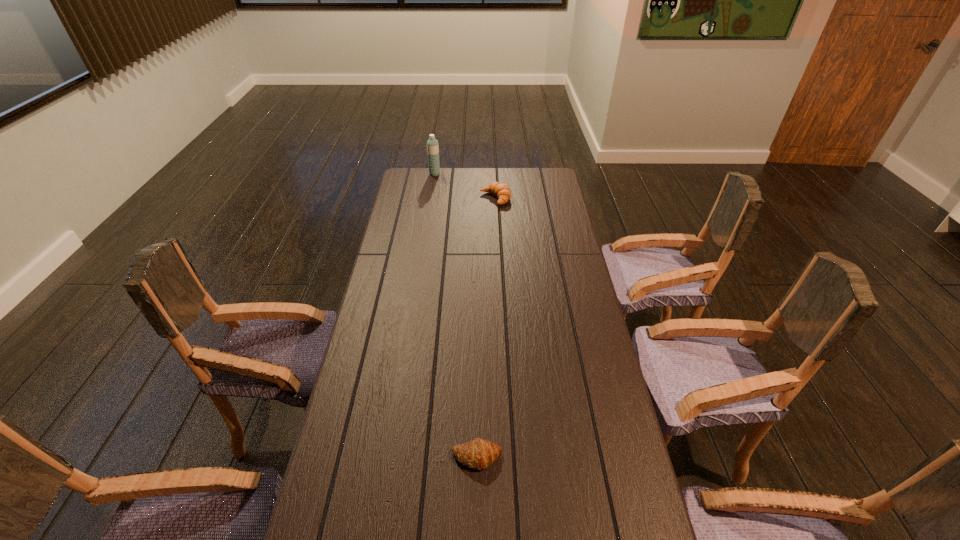
Locate an element on the screen. This screenshot has width=960, height=540. crescent roll that is at the far edge is located at coordinates (502, 191).

The width and height of the screenshot is (960, 540). What are the coordinates of `object present at the left edge` in the screenshot? It's located at (432, 144).

This screenshot has height=540, width=960. What are the coordinates of `object that is at the far left corner` in the screenshot? It's located at (432, 144).

At what (x,y) coordinates should I click in order to perform the action: click on vacant position at the far edge of the desktop. Please return your answer as a coordinate pair (x, y). Looking at the image, I should click on (468, 177).

This screenshot has height=540, width=960. What are the coordinates of `vacant point at the left edge` in the screenshot? It's located at (404, 330).

Identify the location of free space at the right edge of the desktop. The height and width of the screenshot is (540, 960). (555, 289).

Identify the location of vacant space at the far right corner of the desktop. This screenshot has height=540, width=960. (536, 170).

Image resolution: width=960 pixels, height=540 pixels. Find the location of `free area in between the taller crescent roll and the leftmost object`. free area in between the taller crescent roll and the leftmost object is located at coordinates (465, 186).

Image resolution: width=960 pixels, height=540 pixels. Identify the location of vacant space in between the tallest object and the second farthest object. (465, 186).

I want to click on vacant area between the tallest object and the shorter crescent roll, so click(x=456, y=315).